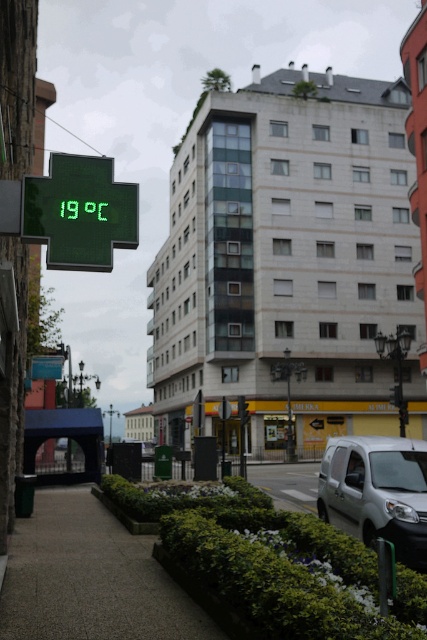
Does green leafy shrubs at lower center have a greater height compared to silver metallic van at center?

Correct, green leafy shrubs at lower center is much taller as silver metallic van at center.

Is green leafy shrubs at lower center smaller than silver metallic van at center?

No, green leafy shrubs at lower center is not smaller than silver metallic van at center.

Which is in front, point (271, 545) or point (368, 525)?

Point (271, 545) is in front.

You are a GUI agent. You are given a task and a screenshot of the screen. Output one action in this format:
    pyautogui.click(x=<x>, y=<y>)
    Task: Click on the green leafy shrubs at lower center
    Image resolution: width=427 pixels, height=640 pixels.
    Given the screenshot: What is the action you would take?
    pyautogui.click(x=274, y=563)

Can you confirm if gray concrete pavement at lower center is bigger than silver metallic van at center?

Yes, gray concrete pavement at lower center is bigger than silver metallic van at center.

Who is more forward, [35,621] or [391,442]?

Positioned in front is point [35,621].

Find the location of a particular element. gray concrete pavement at lower center is located at coordinates (90, 579).

Does green leafy shrubs at lower center have a smaller size compared to green electronic display at upper left?

Correct, green leafy shrubs at lower center occupies less space than green electronic display at upper left.

Does point (146, 499) come closer to viewer compared to point (87, 216)?

No, (146, 499) is further to viewer.

This screenshot has height=640, width=427. I want to click on green leafy shrubs at lower center, so click(x=274, y=563).